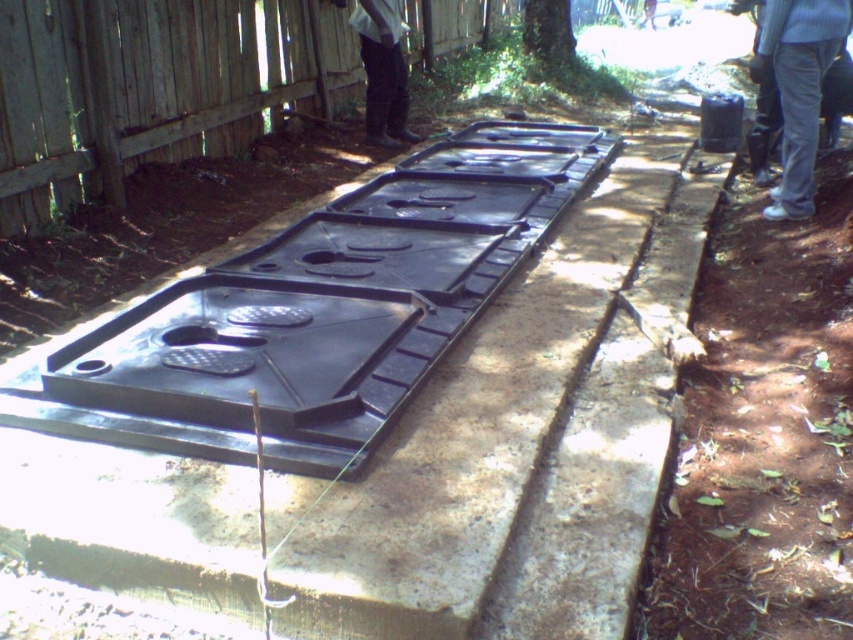
Question: Which point is closer to the camera taking this photo?

Choices:
 (A) (45, 134)
 (B) (386, 3)
 (C) (540, 321)
 (D) (798, 132)

Answer: (C)

Question: Which of the following is the farthest from the observer?

Choices:
 (A) black plastic tank at center
 (B) wooden fence at upper left

Answer: (B)

Question: Which is farther from the white fabric pants at center?

Choices:
 (A) wooden fence at upper left
 (B) gray cotton pants at lower right

Answer: (B)

Question: Does black plastic tank at center have a lesser width compared to gray cotton pants at lower right?

Choices:
 (A) yes
 (B) no

Answer: (B)

Question: Considering the relative positions of black plastic tank at center and white fabric pants at center in the image provided, where is black plastic tank at center located with respect to white fabric pants at center?

Choices:
 (A) left
 (B) right

Answer: (B)

Question: Is black plastic tank at center thinner than wooden fence at upper left?

Choices:
 (A) no
 (B) yes

Answer: (A)